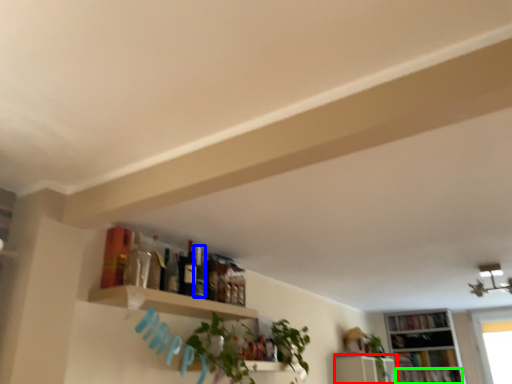
Question: Which object is positioned farthest from shelf (highlighted by a red box)? Select from bottle (highlighted by a blue box) and book (highlighted by a green box).

Choices:
 (A) bottle
 (B) book

Answer: (A)